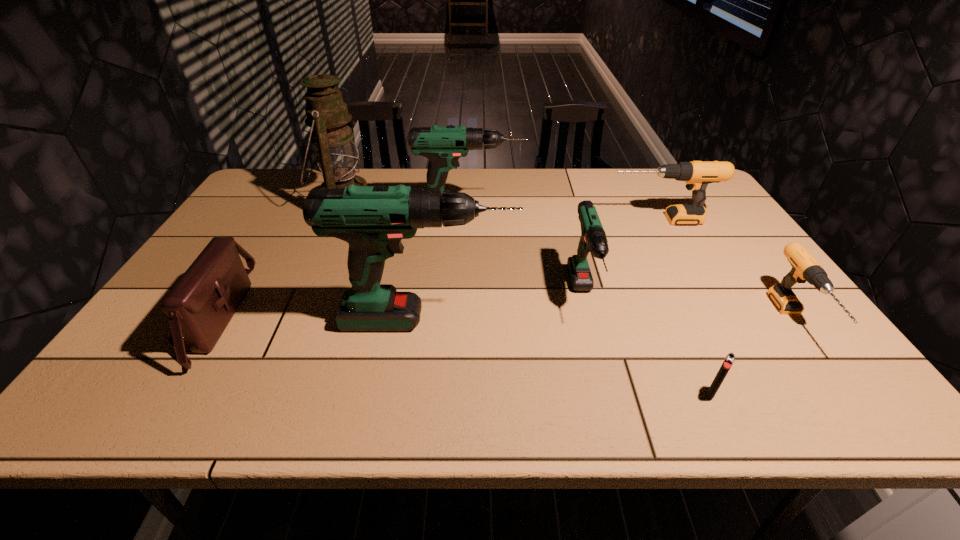
Locate an element on the screen. The width and height of the screenshot is (960, 540). vacant space situated on the front flap of the shoulder bag is located at coordinates (364, 318).

Identify the location of blank space located 0.390m on the left of the igniter. (513, 394).

The width and height of the screenshot is (960, 540). What are the coordinates of `object situated at the far edge` in the screenshot? It's located at (336, 154).

Image resolution: width=960 pixels, height=540 pixels. In order to click on object that is positioned at the near edge in this screenshot , I will do tap(729, 360).

At what (x,y) coordinates should I click in order to perform the action: click on object that is at the left edge. Please return your answer as a coordinate pair (x, y). The image size is (960, 540). Looking at the image, I should click on (200, 305).

Locate an element on the screen. free space at the far edge of the desktop is located at coordinates (489, 184).

This screenshot has height=540, width=960. In the image, there is a desktop. What are the coordinates of `free space at the near edge` in the screenshot? It's located at (610, 382).

In the image, there is a desktop. Find the location of `vacant space at the left edge`. vacant space at the left edge is located at coordinates (272, 228).

In the image, there is a desktop. What are the coordinates of `vacant space at the far left corner` in the screenshot? It's located at (290, 184).

Where is `vacant space that is in between the farther black drill and the third tallest object`? The width and height of the screenshot is (960, 540). vacant space that is in between the farther black drill and the third tallest object is located at coordinates (564, 217).